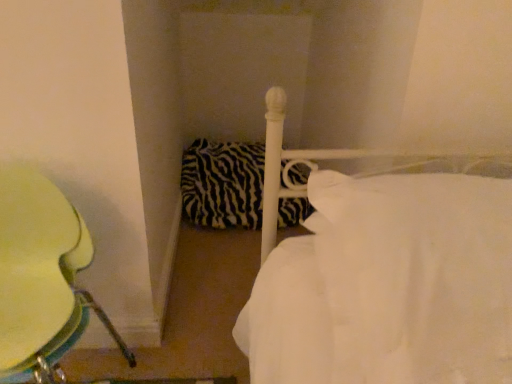
Question: From the image's perspective, is white smooth bed at center above or below metallic green chair at left?

Choices:
 (A) below
 (B) above

Answer: (B)

Question: From a real-world perspective, is white smooth bed at center positioned above or below metallic green chair at left?

Choices:
 (A) below
 (B) above

Answer: (B)

Question: Estimate the real-world distances between objects in this image. Which object is closer to the white smooth bed at center?

Choices:
 (A) metallic green chair at left
 (B) zebra-patterned fabric pillow at center

Answer: (A)

Question: Which is farther from the white smooth bed at center?

Choices:
 (A) metallic green chair at left
 (B) zebra-patterned fabric pillow at center

Answer: (B)